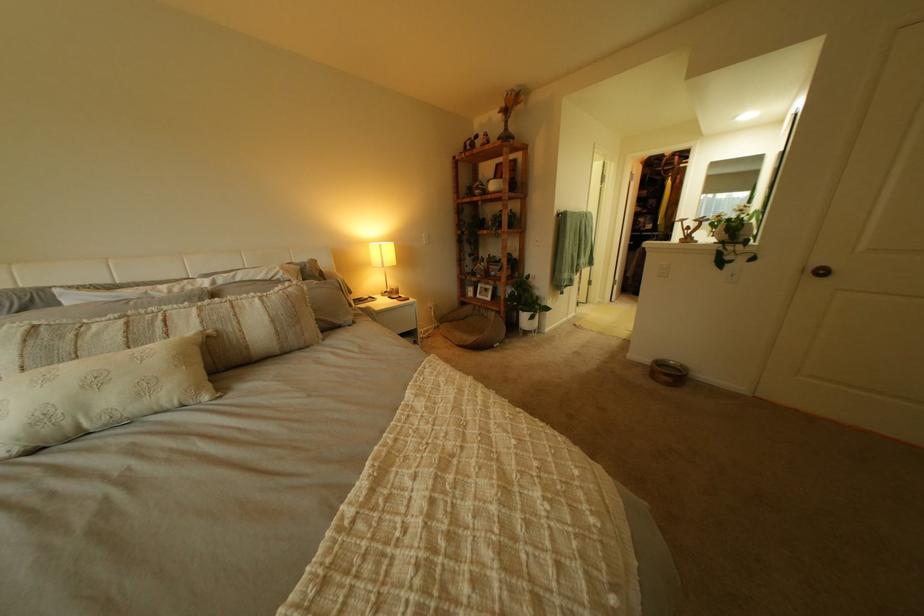
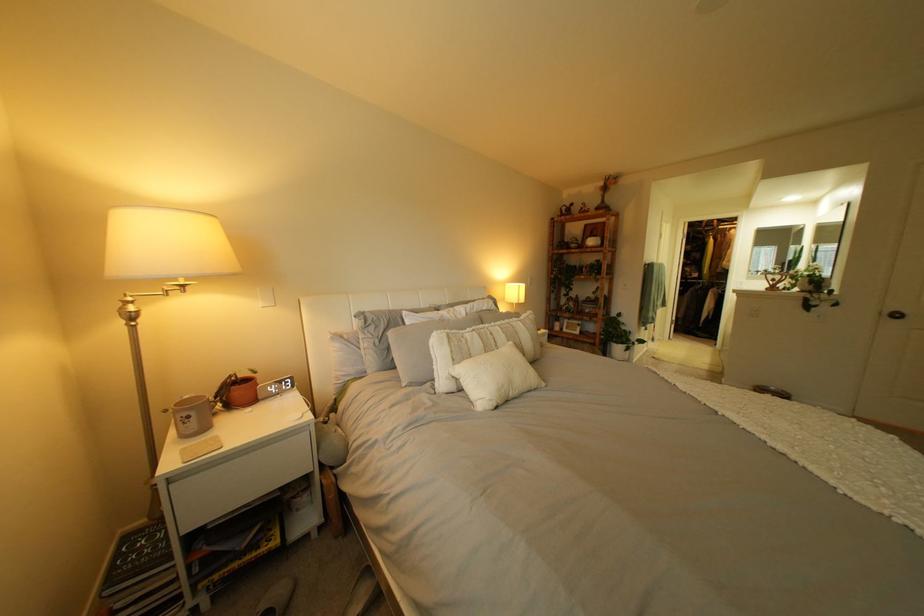
Find the pixel in the second image that matches point 92,359 in the first image.

(485, 355)